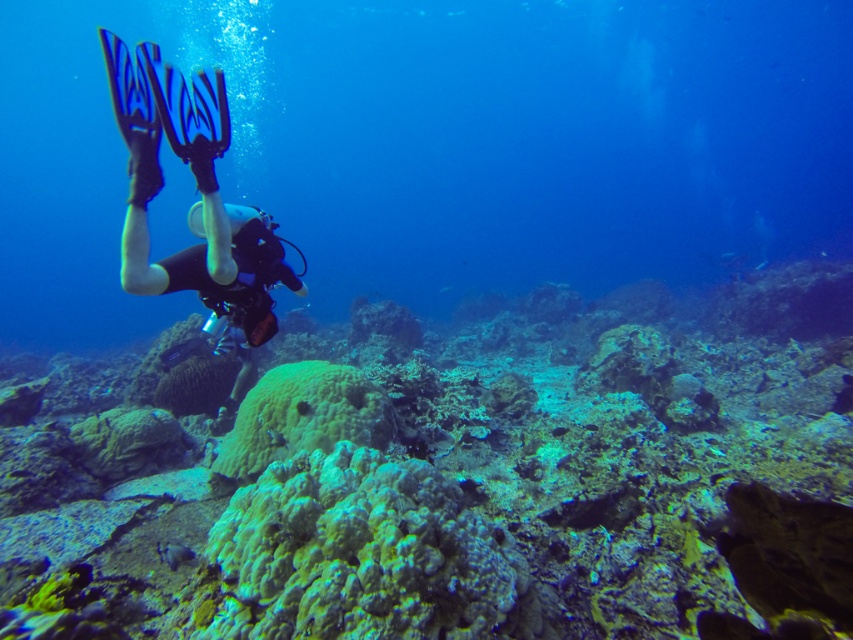
You are a scuba diver with a 6.00 feet long safety line. You are currently at the position of the viewer in the image and want to reach the green coral reef at center. Can your safety line allow you to reach it?

The distance between you and the green coral reef at center is 5.50 feet, which is less than the 6.00 feet length of your safety line. Therefore, your safety line can allow you to reach the green coral reef at center.